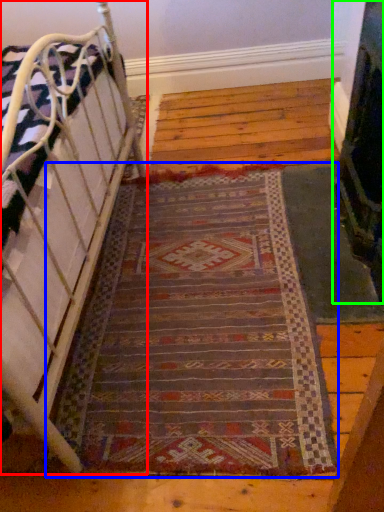
Question: Considering the real-world distances, which object is farthest from furniture (highlighted by a red box)? mat (highlighted by a blue box) or fireplace (highlighted by a green box)?

Choices:
 (A) mat
 (B) fireplace

Answer: (B)